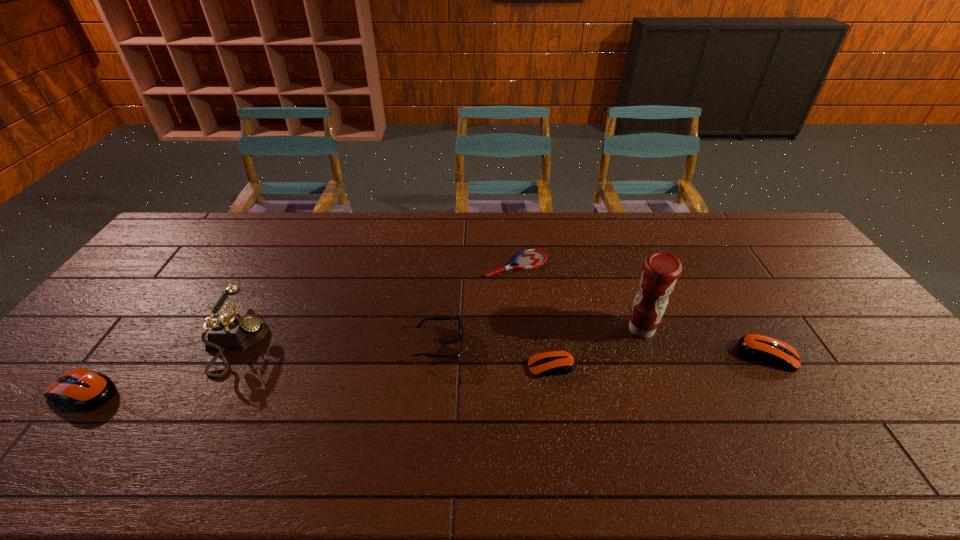
Where is `the sixth object from right to left`? the sixth object from right to left is located at coordinates (235, 329).

Find the location of a particular element. telephone is located at coordinates (235, 329).

Where is `blank space located 0.090m on the back of the leftmost object`? The height and width of the screenshot is (540, 960). blank space located 0.090m on the back of the leftmost object is located at coordinates (121, 345).

Find the location of a particular element. This screenshot has width=960, height=540. free space located 0.100m on the front of the second computer mouse from right to left is located at coordinates (559, 413).

Identify the location of free location located on the left of the rightmost computer mouse. (599, 355).

Where is `free region located on the left of the shortest object`? free region located on the left of the shortest object is located at coordinates (408, 265).

Identify the location of vacant region located on the right of the condiment. The width and height of the screenshot is (960, 540). (698, 330).

The width and height of the screenshot is (960, 540). What are the coordinates of `vacant region located on the front-facing side of the third object from left to right` in the screenshot? It's located at (589, 346).

You are a GUI agent. You are given a task and a screenshot of the screen. Output one action in this format:
    pyautogui.click(x=<x>, y=<y>)
    Task: Click on the vacant space located 0.080m on the dial of the sixth shortest object
    The image size is (960, 540).
    Given the screenshot: What is the action you would take?
    pyautogui.click(x=292, y=343)

The image size is (960, 540). What are the coordinates of `object located in the near edge section of the desktop` in the screenshot? It's located at (84, 390).